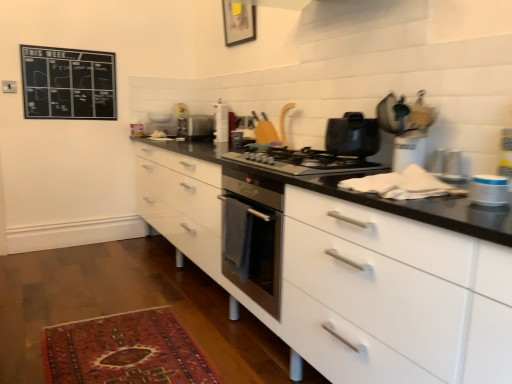
This screenshot has width=512, height=384. I want to click on empty space that is ontop of black chalkboard at upper left (from a real-world perspective), so click(78, 42).